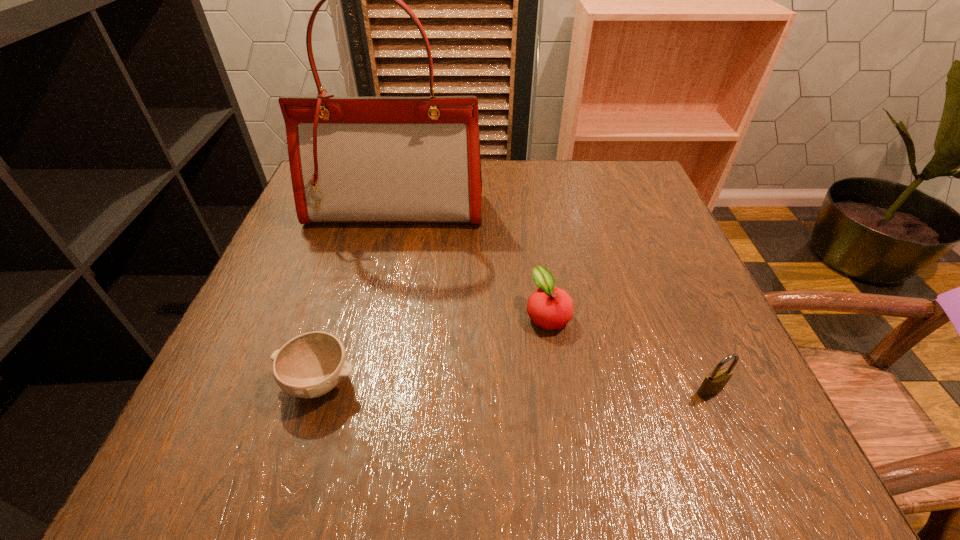
You are a GUI agent. You are given a task and a screenshot of the screen. Output one action in this format:
    pyautogui.click(x=<x>, y=<y>)
    Task: Click on the blank space located 0.370m on the back of the bowl
    The height and width of the screenshot is (540, 960).
    Given the screenshot: What is the action you would take?
    pyautogui.click(x=368, y=222)

This screenshot has width=960, height=540. What are the coordinates of `object that is at the far edge` in the screenshot? It's located at (352, 159).

Image resolution: width=960 pixels, height=540 pixels. I want to click on handbag that is at the left edge, so click(352, 159).

Locate an element on the screen. The height and width of the screenshot is (540, 960). bowl located at the left edge is located at coordinates (310, 365).

Identify the location of object located at the right edge. (715, 382).

The width and height of the screenshot is (960, 540). I want to click on object that is positioned at the far left corner, so click(x=352, y=159).

Image resolution: width=960 pixels, height=540 pixels. In order to click on vacant space at the far edge of the desktop in this screenshot , I will do `click(516, 188)`.

This screenshot has height=540, width=960. Find the location of `vacant region at the near edge of the desktop`. vacant region at the near edge of the desktop is located at coordinates (314, 416).

You are a GUI agent. You are given a task and a screenshot of the screen. Output one action in this format:
    pyautogui.click(x=<x>, y=<y>)
    Task: Click on the free space at the left edge
    
    Given the screenshot: What is the action you would take?
    pyautogui.click(x=313, y=235)

The image size is (960, 540). In the image, there is a desktop. In order to click on vacant area at the right edge in this screenshot , I will do `click(626, 278)`.